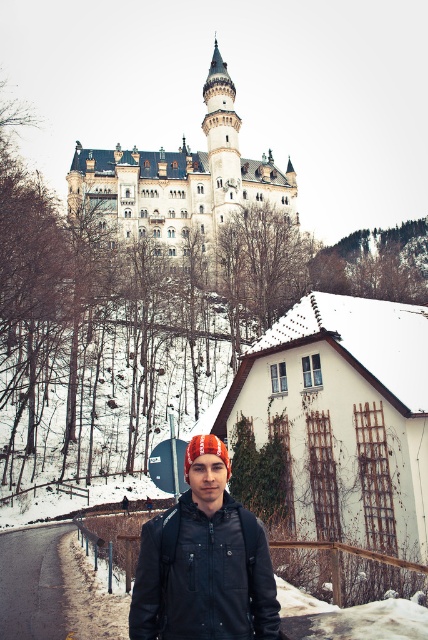
Question: Among these objects, which one is nearest to the camera?

Choices:
 (A) white stone castle at upper center
 (B) black leather jacket at center

Answer: (B)

Question: From the image, what is the correct spatial relationship of white stone castle at upper center in relation to black leather jacket at center?

Choices:
 (A) right
 (B) left

Answer: (B)

Question: Which point is closer to the camera?

Choices:
 (A) black leather jacket at center
 (B) white stone castle at upper center

Answer: (A)

Question: Is white stone castle at upper center below black leather jacket at center?

Choices:
 (A) yes
 (B) no

Answer: (B)

Question: Does white stone castle at upper center appear on the left side of black leather jacket at center?

Choices:
 (A) no
 (B) yes

Answer: (B)

Question: Which object is closer to the camera taking this photo?

Choices:
 (A) black leather jacket at center
 (B) white stone castle at upper center

Answer: (A)